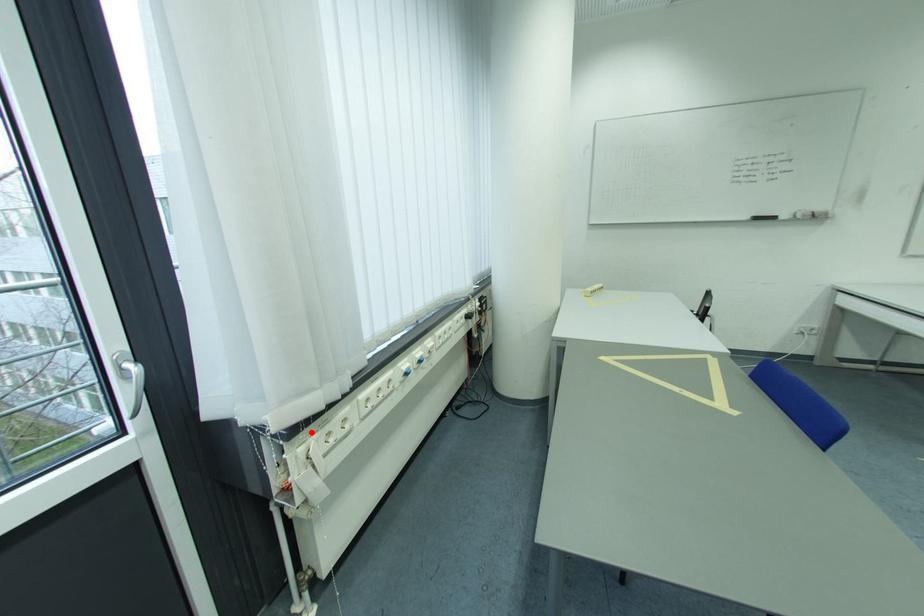
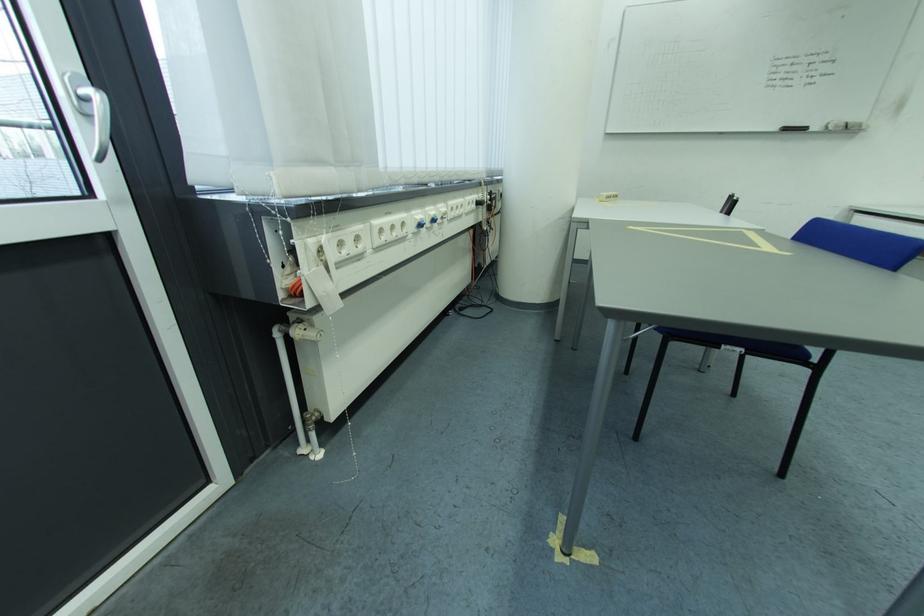
Where in the second image is the point corresponding to the highlighted location from the first image?

(322, 217)